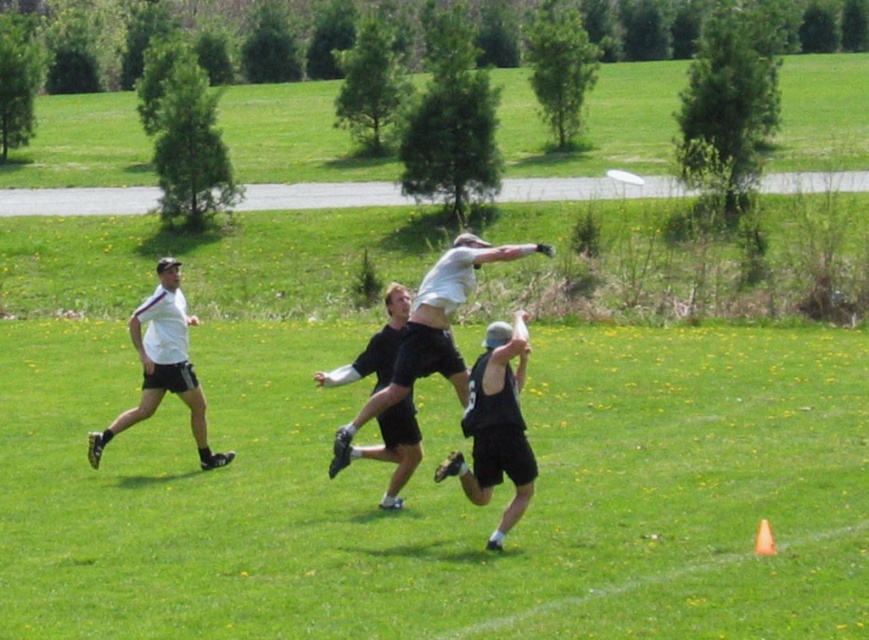
You are a photographer positioned at the edge of the field. You notice two players wearing white matte shirts in the scene. Which one is positioned closer to you, the photographer, the white matte shirt at center or the white matte shirt at left?

The white matte shirt at center is closer to the viewer than the white matte shirt at left, so the one at center is closer to you.

You are a spectator at the ultimate frisbee game and want to know which player wearing a white matte shirt is closer to the center of the field. Based on the positions of the white matte shirt at center and white matte shirt at left, which one is positioned closer to the center?

The white matte shirt at center is positioned closer to the center of the field than the white matte shirt at left.

You are a player in an ultimate frisbee game on a sunny day. You notice a point marked at coordinates (x=395, y=448). What object is located at that point?

The point at coordinates (x=395, y=448) indicates the location of the black matte shorts at center.